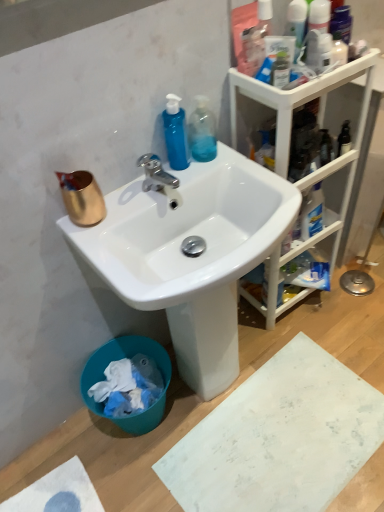
Locate an element on the screen. This screenshot has width=384, height=512. vacant region above white matte cardboard at lower right (from a real-world perspective) is located at coordinates (278, 436).